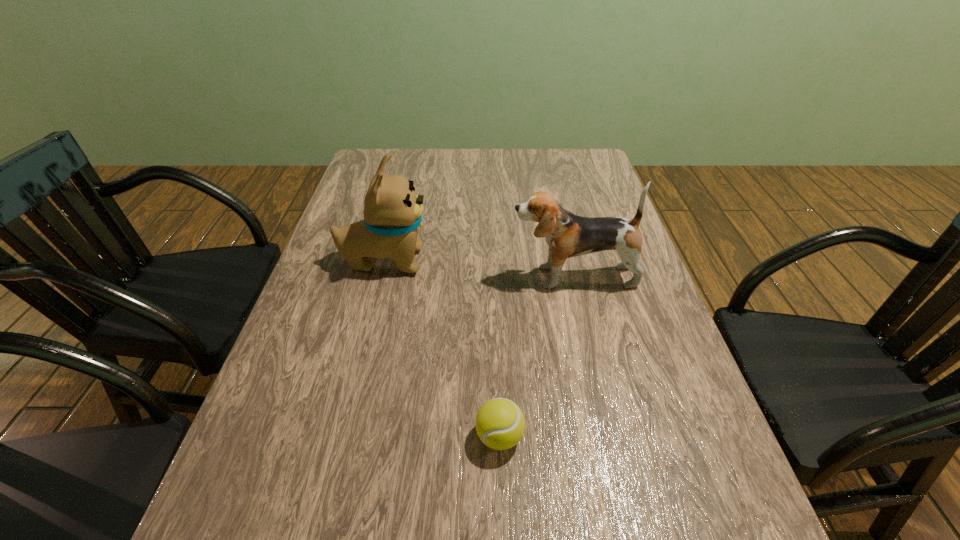
Find the location of a particular element. Image resolution: width=960 pixels, height=540 pixels. the leftmost object is located at coordinates (392, 212).

Identify the location of the right puppy. (568, 235).

Locate an element on the screen. the nearest object is located at coordinates (500, 424).

Locate an element on the screen. This screenshot has height=540, width=960. tennis ball is located at coordinates (500, 424).

I want to click on free space located on the face of the leftmost object, so click(574, 260).

You are a GUI agent. You are given a task and a screenshot of the screen. Output one action in this format:
    pyautogui.click(x=<x>, y=<y>)
    Task: Click on the free space located 0.090m at the face of the right puppy
    Image resolution: width=960 pixels, height=540 pixels.
    Given the screenshot: What is the action you would take?
    pyautogui.click(x=475, y=277)

The image size is (960, 540). What are the coordinates of `vacant space located at the face of the right puppy` in the screenshot? It's located at (x=399, y=277).

Locate an element on the screen. This screenshot has height=540, width=960. free space located 0.260m at the face of the right puppy is located at coordinates (407, 277).

Locate an element on the screen. free region located on the right of the nearest object is located at coordinates (573, 436).

At what (x,y) coordinates should I click in order to perform the action: click on object located at the left edge. Please return your answer as a coordinate pair (x, y). Looking at the image, I should click on (392, 212).